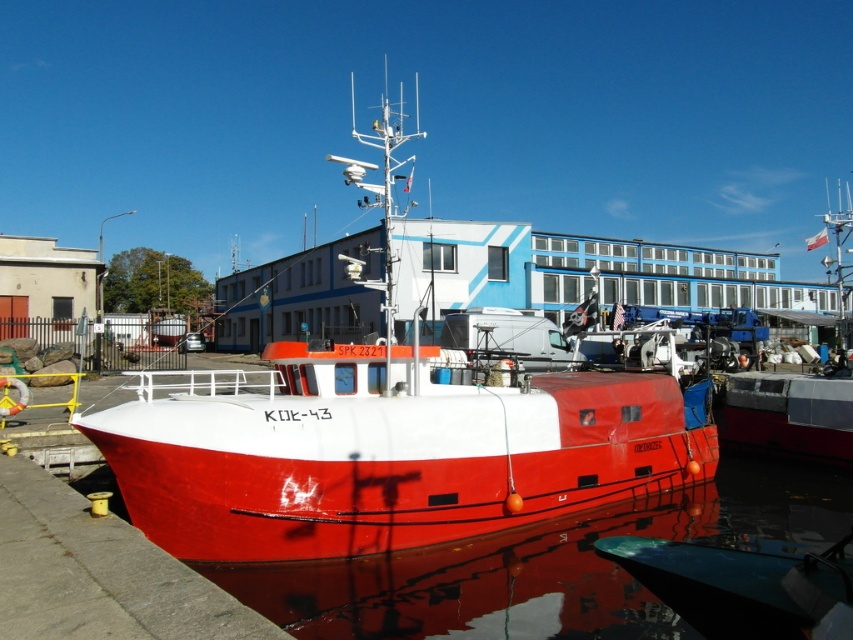
Does glossy water at boat front appear on the right side of red matte boat at center?

No, glossy water at boat front is not to the right of red matte boat at center.

At what (x,y) coordinates should I click in order to perform the action: click on glossy water at boat front. Please return your answer as a coordinate pair (x, y). Looking at the image, I should click on (548, 564).

Which is in front, point (549, 344) or point (838, 321)?

Point (549, 344) is more forward.

Does shiny red boat at center have a greater height compared to red matte boat at center?

Indeed, shiny red boat at center has a greater height compared to red matte boat at center.

Which is behind, point (229, 433) or point (828, 464)?

The point (828, 464) is more distant.

Identify the location of shiny red boat at center. (396, 436).

Does shiny red boat at center have a greater height compared to glossy water at boat front?

Yes.

Who is more forward, (213, 522) or (485, 636)?

Positioned in front is point (485, 636).

Identify the location of shiny red boat at center. Image resolution: width=853 pixels, height=640 pixels. (396, 436).

Find the location of `shiny red boat at center`. shiny red boat at center is located at coordinates (396, 436).